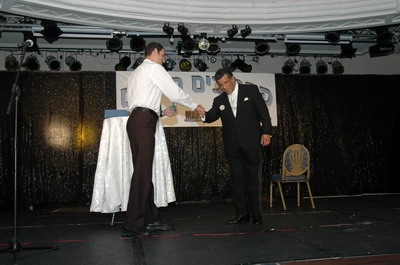
At what (x,y) coordinates should I click in order to perform the action: click on chair legs. Please return your answer as a coordinate pair (x, y). The width and height of the screenshot is (400, 265). Looking at the image, I should click on (310, 196), (301, 195), (284, 194), (273, 190).